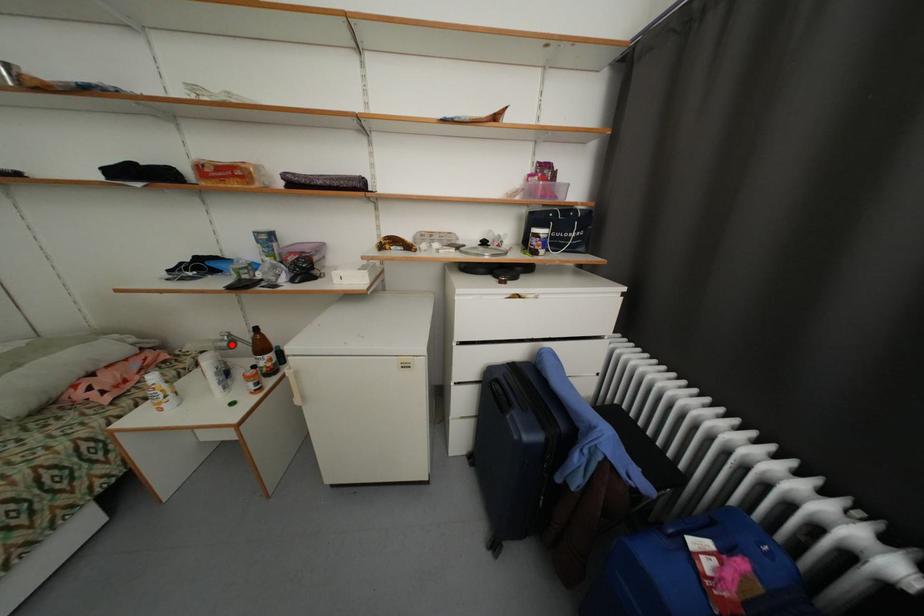
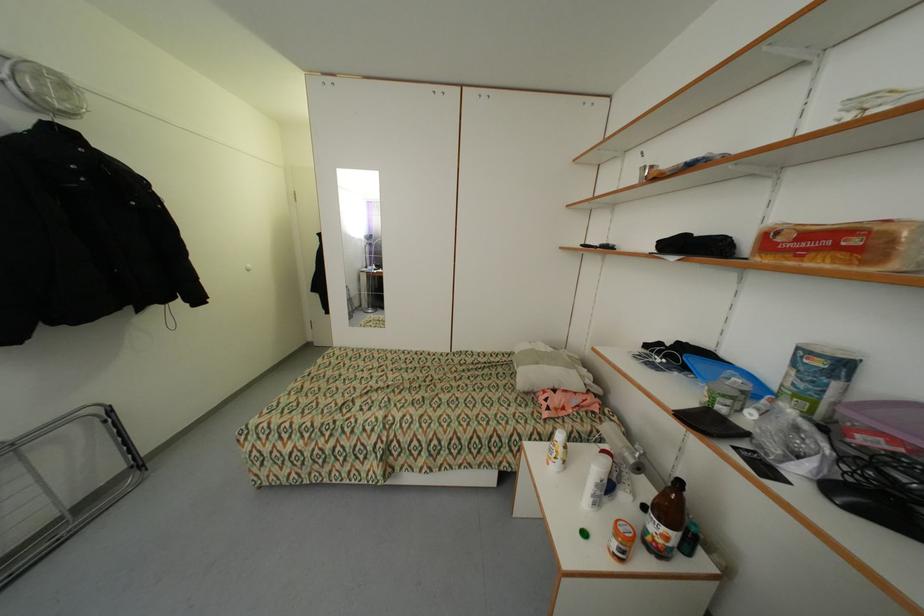
Find the pixel in the second image that matches the highlighted location in the first image.

(638, 462)